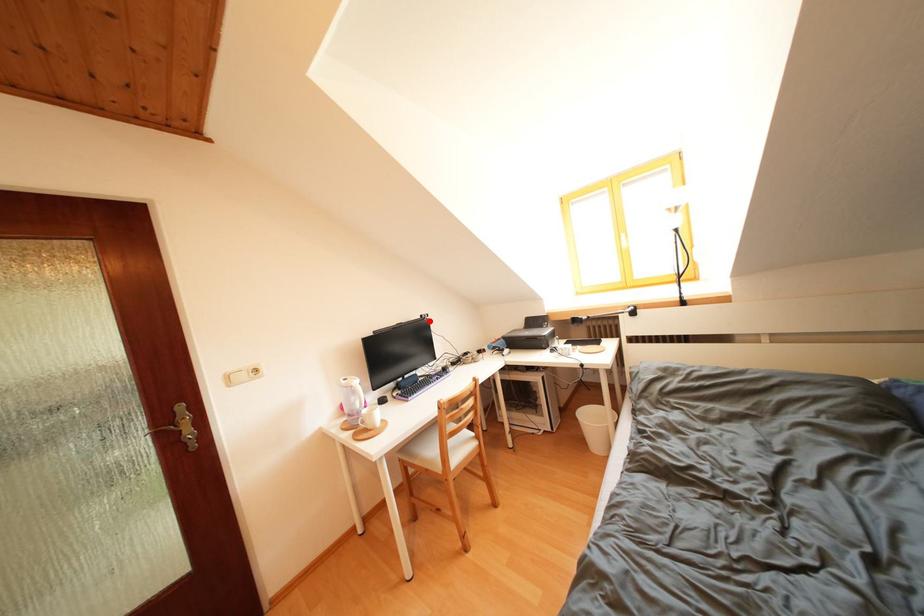
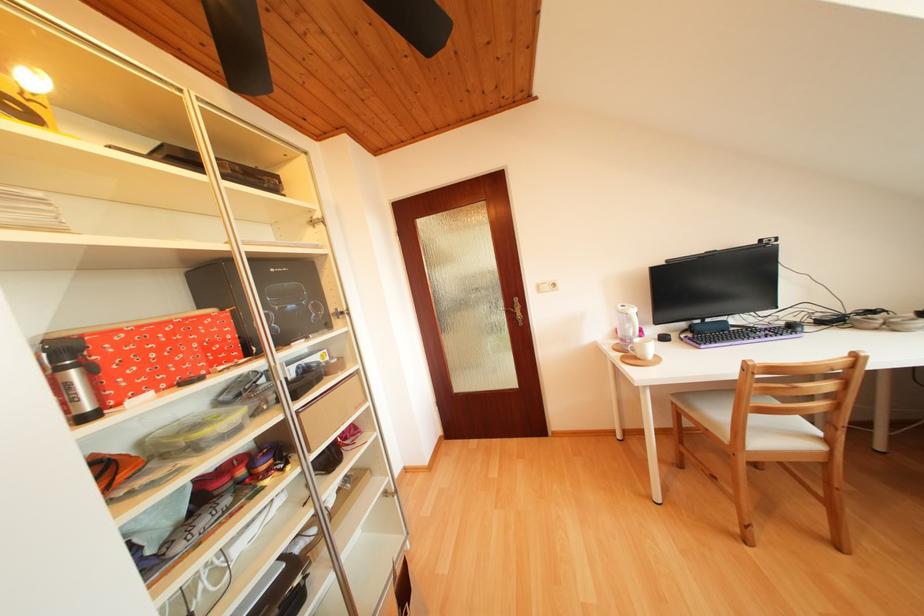
Locate, in the second image, the point that corresponds to the highlighted location in the first image.

(769, 246)